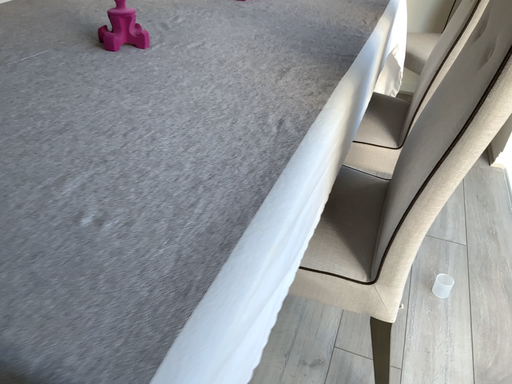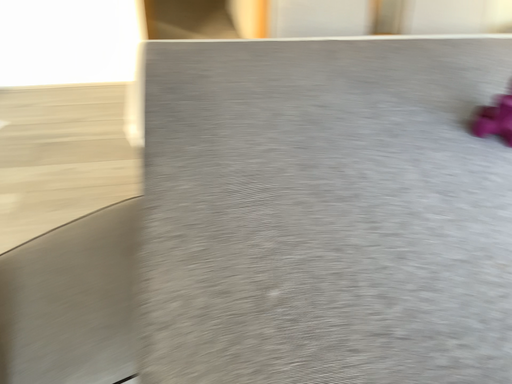
Question: How did the camera likely rotate when shooting the video?

Choices:
 (A) rotated left
 (B) rotated right

Answer: (A)